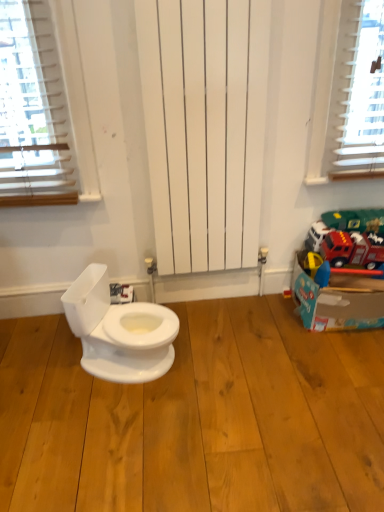
Image resolution: width=384 pixels, height=512 pixels. What do you see at coordinates (337, 298) in the screenshot?
I see `cardboard box at right` at bounding box center [337, 298].

You are a GUI agent. You are given a task and a screenshot of the screen. Output one action in this format:
    pyautogui.click(x=<x>, y=<y>)
    Task: Click on the cardboard box at right
    The image size is (384, 512).
    Given the screenshot: What is the action you would take?
    pyautogui.click(x=337, y=298)

Image resolution: width=384 pixels, height=512 pixels. What do you see at coordinates (196, 418) in the screenshot?
I see `light brown wood flooring at center` at bounding box center [196, 418].

Find the location of a particular element. Image resolution: width=384 pixels, height=512 pixels. light brown wood flooring at center is located at coordinates (196, 418).

Locate an element on the screen. cardboard box at right is located at coordinates (337, 298).

Is cardboard box at right to the right of light brown wood flooring at center from the viewer's perspective?

Yes.

Between cardboard box at right and light brown wood flooring at center, which one is positioned in front?

light brown wood flooring at center is closer to the camera.

Is point (337, 297) positioned after point (209, 311)?

No, it is in front of (209, 311).

From the image's perspective, does cardboard box at right appear lower than light brown wood flooring at center?

Actually, cardboard box at right appears above light brown wood flooring at center in the image.

From a real-world perspective, which is physically above, cardboard box at right or light brown wood flooring at center?

In real-world perspective, cardboard box at right is above.

Does cardboard box at right have a greater width compared to light brown wood flooring at center?

No, cardboard box at right is not wider than light brown wood flooring at center.

Can you confirm if cardboard box at right is shorter than light brown wood flooring at center?

No, cardboard box at right is not shorter than light brown wood flooring at center.

Between cardboard box at right and light brown wood flooring at center, which one has larger size?

Bigger between the two is light brown wood flooring at center.

From the picture: Is light brown wood flooring at center completely or partially inside cardboard box at right?

Actually, light brown wood flooring at center is outside cardboard box at right.

Is cardboard box at right not close to light brown wood flooring at center?

No.

Could you tell me if cardboard box at right is facing light brown wood flooring at center?

No, cardboard box at right is not turned towards light brown wood flooring at center.

How many degrees apart are the facing directions of cardboard box at right and light brown wood flooring at center?

2.34 degrees separate the facing orientations of cardboard box at right and light brown wood flooring at center.

This screenshot has width=384, height=512. I want to click on cardboard box that is above the light brown wood flooring at center (from a real-world perspective), so click(337, 298).

Considering the relative positions of light brown wood flooring at center and cardboard box at right in the image provided, is light brown wood flooring at center to the left or to the right of cardboard box at right?

Clearly, light brown wood flooring at center is on the left of cardboard box at right in the image.

Is light brown wood flooring at center positioned in front of cardboard box at right?

Yes, it is in front of cardboard box at right.

Considering the positions of point (55, 448) and point (307, 300), is point (55, 448) closer or farther from the camera than point (307, 300)?

Point (55, 448) appears to be closer to the viewer than point (307, 300).

From the image's perspective, is light brown wood flooring at center located beneath cardboard box at right?

Correct, light brown wood flooring at center appears lower than cardboard box at right in the image.

From a real-world perspective, is light brown wood flooring at center positioned under cardboard box at right based on gravity?

Indeed, from a real-world perspective, light brown wood flooring at center is positioned beneath cardboard box at right.

Between light brown wood flooring at center and cardboard box at right, which one has larger width?

With larger width is light brown wood flooring at center.

Who is taller, light brown wood flooring at center or cardboard box at right?

cardboard box at right.

Does light brown wood flooring at center have a smaller size compared to cardboard box at right?

No.

Can cardboard box at right be found inside light brown wood flooring at center?

No, cardboard box at right is not a part of light brown wood flooring at center.

Is light brown wood flooring at center not near cardboard box at right?

No, light brown wood flooring at center is in close proximity to cardboard box at right.

Is light brown wood flooring at center aimed at cardboard box at right?

No, light brown wood flooring at center is not aimed at cardboard box at right.

Can you tell me how much light brown wood flooring at center and cardboard box at right differ in facing direction?

2.34 degrees.

How far apart are light brown wood flooring at center and cardboard box at right?

light brown wood flooring at center is 43.27 centimeters from cardboard box at right.

Where is `cardboard box that is on the right side of light brown wood flooring at center`? The width and height of the screenshot is (384, 512). cardboard box that is on the right side of light brown wood flooring at center is located at coordinates (337, 298).

I want to click on cardboard box on the right of the light brown wood flooring at center, so click(x=337, y=298).

At what (x,y) coordinates should I click in order to perform the action: click on hardwood directly beneath the cardboard box at right (from a real-world perspective). Please return your answer as a coordinate pair (x, y). Looking at the image, I should click on (196, 418).